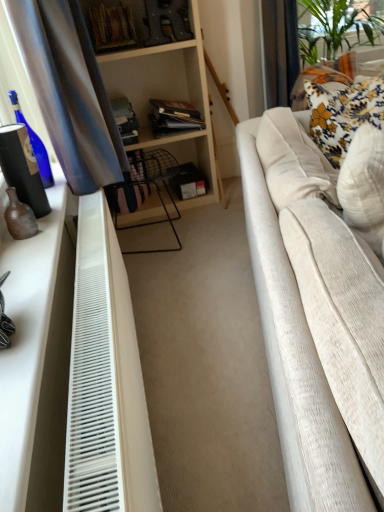
In order to face white textured pillow at right, acting as the second pillow starting from the back, should I rotate leftwards or rightwards?

To align with it, rotate right about 24.530°.

What do you see at coordinates (296, 362) in the screenshot?
I see `beige fabric couch at right` at bounding box center [296, 362].

Image resolution: width=384 pixels, height=512 pixels. Find the location of `satin blue curtain at left`. satin blue curtain at left is located at coordinates (69, 91).

Find the location of `floral fabric pillow at upper right, marked as the 2th pillow in a front-to-back arrangement`. floral fabric pillow at upper right, marked as the 2th pillow in a front-to-back arrangement is located at coordinates (343, 114).

What is the approximate height of floral fabric pillow at upper right, marked as the first pillow in a back-to-front arrangement?

It is 20.43 inches.

Locate an element on the screen. white textured pillow at right, acting as the second pillow starting from the back is located at coordinates (364, 186).

Could you tell me if white textured pillow at right, the 1th pillow viewed from the front, is turned towards white matte dresser at left?

No.

Is white textured pillow at right, the 1th pillow viewed from the front, with white matte dresser at left?

white textured pillow at right, the 1th pillow viewed from the front, and white matte dresser at left are clearly separated.

Does white textured pillow at right, the 1th pillow viewed from the front, have a smaller size compared to white matte dresser at left?

No, white textured pillow at right, the 1th pillow viewed from the front, is not smaller than white matte dresser at left.

How far apart are white matte dresser at left and beige fabric couch at right?

white matte dresser at left and beige fabric couch at right are 21.48 inches apart.

Could beige fabric couch at right be considered to be inside white matte dresser at left?

No, beige fabric couch at right is located outside of white matte dresser at left.

In the image, is white matte dresser at left positioned in front of or behind beige fabric couch at right?

white matte dresser at left is positioned farther from the viewer than beige fabric couch at right.

Between white matte dresser at left and beige fabric couch at right, which one appears on the right side from the viewer's perspective?

Positioned to the right is beige fabric couch at right.

How distant is beige fabric couch at right from white plastic radiator at lower left?

17.57 inches.

Is the surface of beige fabric couch at right in direct contact with white plastic radiator at lower left?

No, beige fabric couch at right is not in contact with white plastic radiator at lower left.

How many degrees apart are the facing directions of beige fabric couch at right and white plastic radiator at lower left?

The facing directions of beige fabric couch at right and white plastic radiator at lower left are 16.1 degrees apart.

From a real-world perspective, is beige fabric couch at right above or below white plastic radiator at lower left?

From a real-world perspective, beige fabric couch at right is physically above white plastic radiator at lower left.

Which object is closer to the camera taking this photo, beige fabric couch at right or white textured pillow at right, the 1th pillow viewed from the front?

beige fabric couch at right is closer to the camera.

Is beige fabric couch at right far from white textured pillow at right, acting as the second pillow starting from the back?

They are positioned close to each other.

Can you confirm if beige fabric couch at right is thinner than white textured pillow at right, the 1th pillow viewed from the front?

In fact, beige fabric couch at right might be wider than white textured pillow at right, the 1th pillow viewed from the front.

Considering the relative sizes of beige fabric couch at right and white textured pillow at right, the 1th pillow viewed from the front, in the image provided, is beige fabric couch at right bigger than white textured pillow at right, the 1th pillow viewed from the front,?

Yes, beige fabric couch at right is bigger than white textured pillow at right, the 1th pillow viewed from the front.

Considering the positions of objects white textured pillow at right, acting as the second pillow starting from the back, and satin blue curtain at left in the image provided, who is in front, white textured pillow at right, acting as the second pillow starting from the back, or satin blue curtain at left?

white textured pillow at right, acting as the second pillow starting from the back, is in front.

This screenshot has height=512, width=384. Find the location of `pillow in front of the satin blue curtain at left`. pillow in front of the satin blue curtain at left is located at coordinates (364, 186).

Consider the image. Which is more to the right, white textured pillow at right, acting as the second pillow starting from the back, or satin blue curtain at left?

white textured pillow at right, acting as the second pillow starting from the back, is more to the right.

Is white plastic radiator at lower left located within white textured pillow at right, the 1th pillow viewed from the front?

No, white textured pillow at right, the 1th pillow viewed from the front, does not contain white plastic radiator at lower left.

Is white textured pillow at right, the 1th pillow viewed from the front, far away from white plastic radiator at lower left?

No, there isn't a large distance between white textured pillow at right, the 1th pillow viewed from the front, and white plastic radiator at lower left.

Which object is closer to the camera taking this photo, white textured pillow at right, the 1th pillow viewed from the front, or white plastic radiator at lower left?

Positioned in front is white plastic radiator at lower left.

Between white textured pillow at right, acting as the second pillow starting from the back, and white plastic radiator at lower left, which one has more height?

white plastic radiator at lower left.

Is white plastic radiator at lower left at the left side of floral fabric pillow at upper right, marked as the first pillow in a back-to-front arrangement?

Correct, you'll find white plastic radiator at lower left to the left of floral fabric pillow at upper right, marked as the first pillow in a back-to-front arrangement.

Is white plastic radiator at lower left smaller than floral fabric pillow at upper right, marked as the first pillow in a back-to-front arrangement?

Actually, white plastic radiator at lower left might be larger than floral fabric pillow at upper right, marked as the first pillow in a back-to-front arrangement.

Which is more distant, (91, 321) or (344, 156)?

Point (344, 156)

How different are the orientations of white plastic radiator at lower left and floral fabric pillow at upper right, marked as the first pillow in a back-to-front arrangement, in degrees?

There is a 106-degree angle between the facing directions of white plastic radiator at lower left and floral fabric pillow at upper right, marked as the first pillow in a back-to-front arrangement.

Find the location of a particular element. This screenshot has height=512, width=384. dresser that is in front of the white textured pillow at right, the 1th pillow viewed from the front is located at coordinates (37, 356).

This screenshot has width=384, height=512. Find the location of `dresser above the beige fabric couch at right (from a real-world perspective)`. dresser above the beige fabric couch at right (from a real-world perspective) is located at coordinates (37, 356).

From the image, which object appears to be nearer to white textured pillow at right, acting as the second pillow starting from the back, floral fabric pillow at upper right, marked as the first pillow in a back-to-front arrangement, or white plastic radiator at lower left?

The object closer to white textured pillow at right, acting as the second pillow starting from the back, is floral fabric pillow at upper right, marked as the first pillow in a back-to-front arrangement.

Looking at the image, which one is located closer to satin blue curtain at left, white matte dresser at left or white plastic radiator at lower left?

white plastic radiator at lower left lies closer to satin blue curtain at left than the other object.

Considering their positions, is floral fabric pillow at upper right, marked as the 2th pillow in a front-to-back arrangement, positioned further to satin blue curtain at left than white textured pillow at right, acting as the second pillow starting from the back?

Among the two, white textured pillow at right, acting as the second pillow starting from the back, is located further to satin blue curtain at left.

Considering their positions, is white plastic radiator at lower left positioned further to satin blue curtain at left than beige fabric couch at right?

Among the two, beige fabric couch at right is located further to satin blue curtain at left.

Based on their spatial positions, is satin blue curtain at left or beige fabric couch at right closer to white plastic radiator at lower left?

beige fabric couch at right lies closer to white plastic radiator at lower left than the other object.

Based on their spatial positions, is beige fabric couch at right or white matte dresser at left closer to satin blue curtain at left?

Based on the image, white matte dresser at left appears to be nearer to satin blue curtain at left.

Estimate the real-world distances between objects in this image. Which object is further from satin blue curtain at left, white plastic radiator at lower left or white textured pillow at right, acting as the second pillow starting from the back?

white textured pillow at right, acting as the second pillow starting from the back, is further to satin blue curtain at left.

Considering their positions, is satin blue curtain at left positioned closer to beige fabric couch at right than white matte dresser at left?

Among the two, white matte dresser at left is located nearer to beige fabric couch at right.

Locate an element on the screen. This screenshot has height=512, width=384. studio couch located between white matte dresser at left and floral fabric pillow at upper right, marked as the 2th pillow in a front-to-back arrangement, in the left-right direction is located at coordinates (296, 362).

In order to click on curtain situated between white matte dresser at left and floral fabric pillow at upper right, marked as the first pillow in a back-to-front arrangement, from left to right in this screenshot , I will do `click(69, 91)`.

Identify the location of curtain located between white matte dresser at left and white textured pillow at right, the 1th pillow viewed from the front, in the left-right direction. (69, 91).

Identify the location of air conditioning positioned between beige fabric couch at right and floral fabric pillow at upper right, marked as the first pillow in a back-to-front arrangement, from near to far. This screenshot has height=512, width=384. (93, 374).